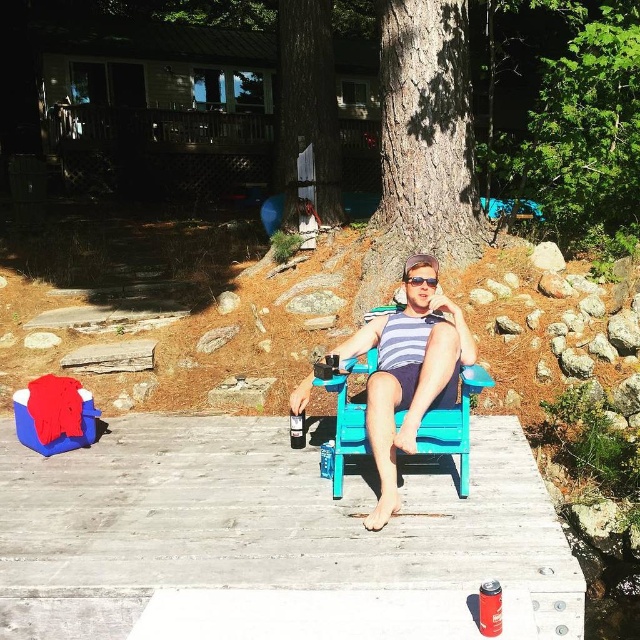
Question: From the image, what is the correct spatial relationship of metallic silver can at lower right in relation to metallic can at center?

Choices:
 (A) right
 (B) left

Answer: (A)

Question: Where is wooden dock at center located in relation to green leafy tree at upper right in the image?

Choices:
 (A) above
 (B) below

Answer: (B)

Question: Which point is closer to the camera?

Choices:
 (A) (369, 264)
 (B) (300, 445)
 (C) (618, 26)
 (D) (404, 408)

Answer: (D)

Question: Which point appears farthest from the camera in this image?

Choices:
 (A) (416, 280)
 (B) (516, 170)

Answer: (B)

Question: Can you confirm if blue wood chair at center is positioned above red plastic goggles at center?

Choices:
 (A) yes
 (B) no

Answer: (B)

Question: Which is farther from the blue wood chair at center?

Choices:
 (A) brown rough bark tree at center
 (B) metallic silver can at lower right
 (C) green leafy tree at upper right
 (D) metallic can at center

Answer: (C)